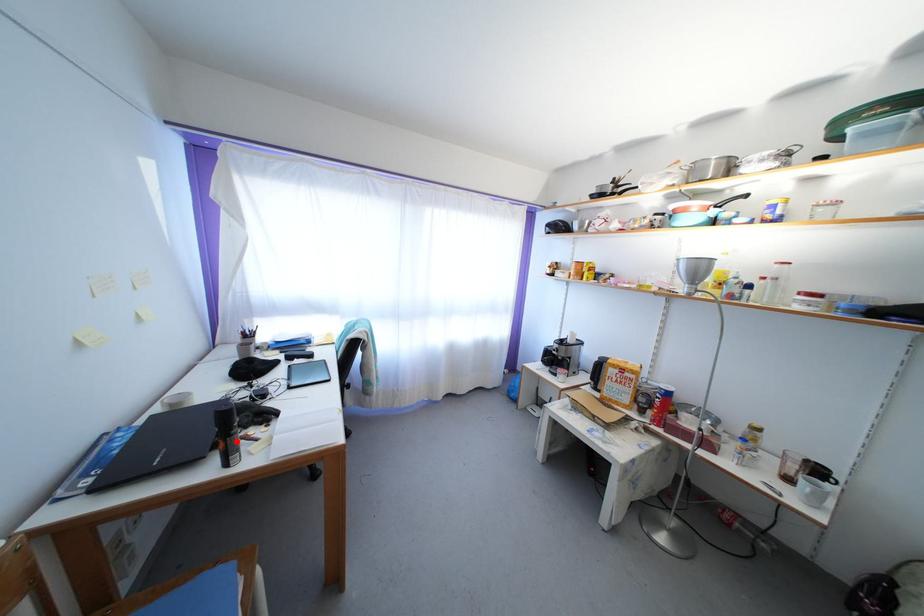
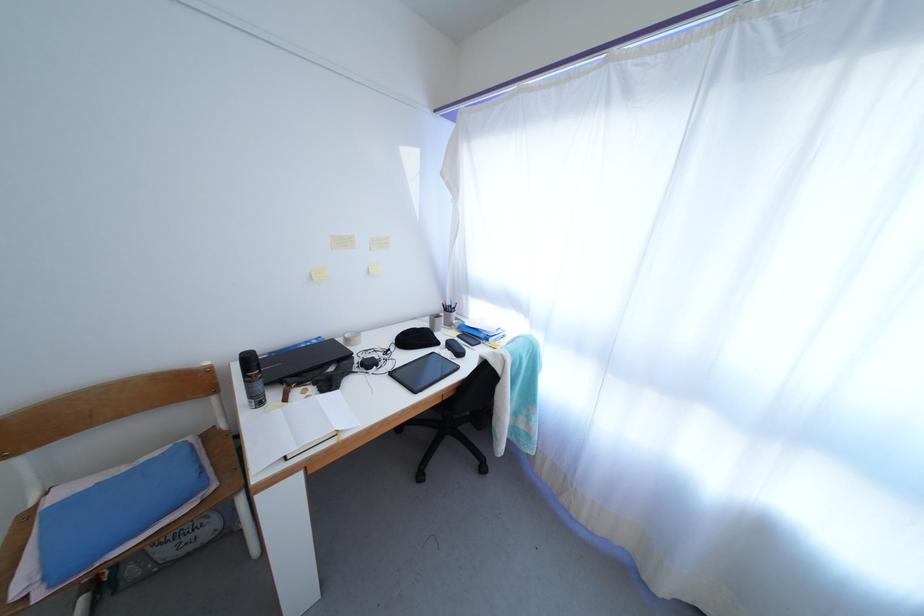
Find the pixel in the second image that matches the highlighted location in the first image.

(250, 387)